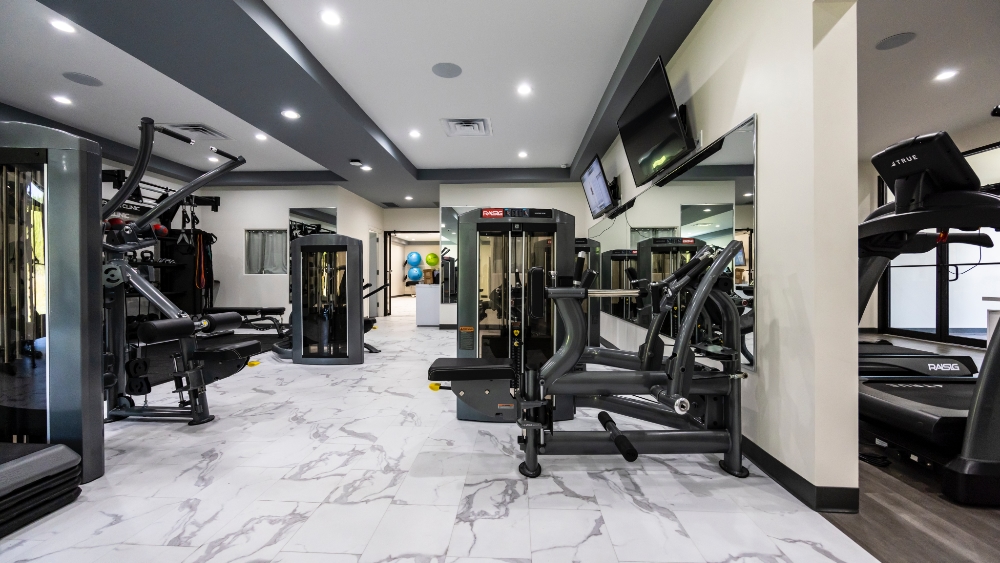
Image resolution: width=1000 pixels, height=563 pixels. What are the coordinates of `hallway` in the screenshot? It's located at (402, 302).